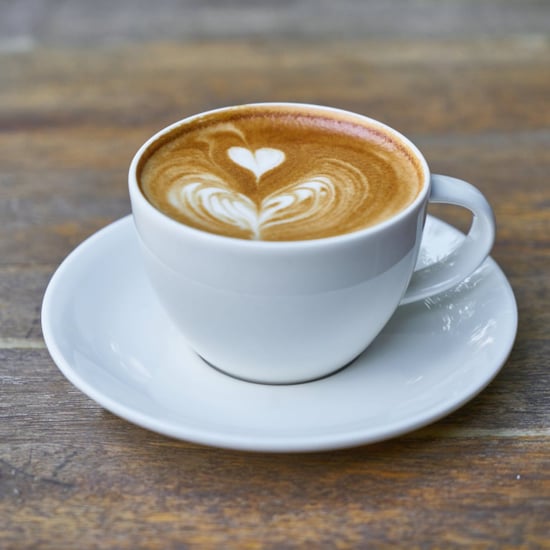
The height and width of the screenshot is (550, 550). I want to click on cup, so click(x=308, y=351).